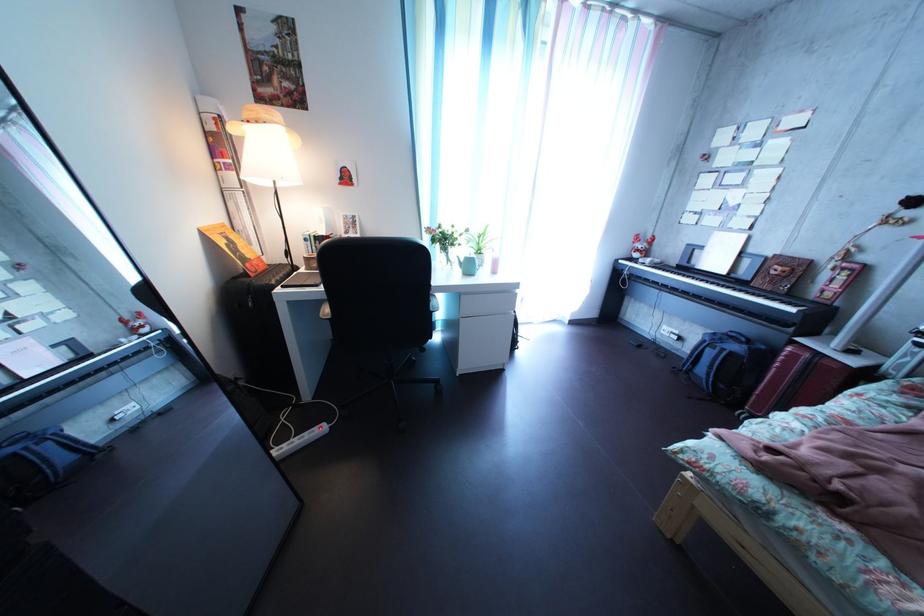
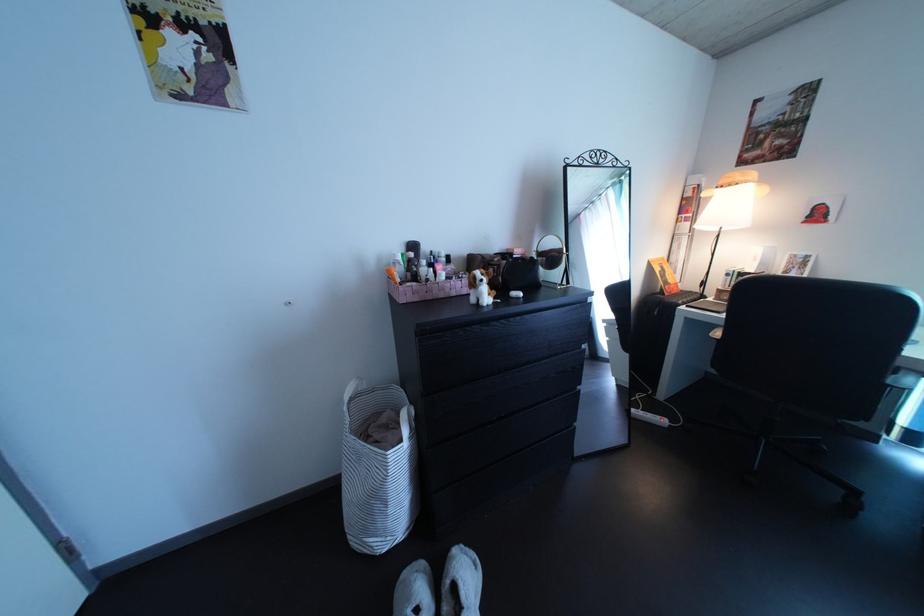
Question: How did the camera likely rotate?

Choices:
 (A) Left
 (B) Right
 (C) Up
 (D) Down

Answer: (A)